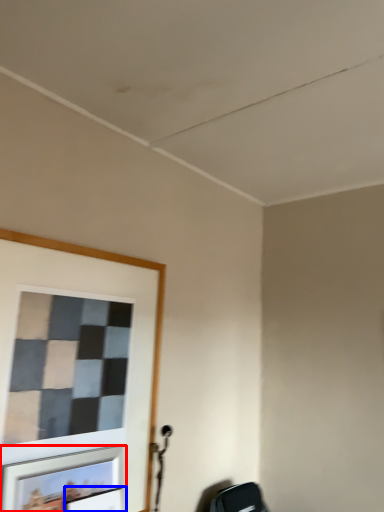
Question: Which point is closer to the camera, picture frame (highlighted by a red box) or picture frame (highlighted by a blue box)?

Choices:
 (A) picture frame
 (B) picture frame

Answer: (A)